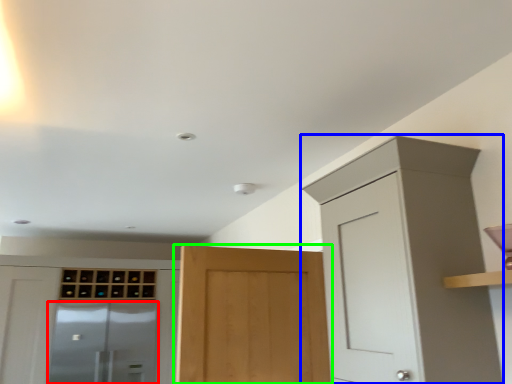
Question: Which is farther away from screen door (highlighted by a red box)? cabinetry (highlighted by a blue box) or door (highlighted by a green box)?

Choices:
 (A) cabinetry
 (B) door

Answer: (A)